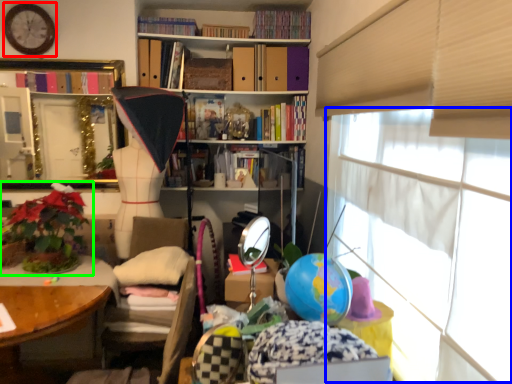
Question: Based on their relative distances, which object is nearer to clock (highlighted by a red box)? Choose from window screen (highlighted by a blue box) and houseplant (highlighted by a green box).

Choices:
 (A) window screen
 (B) houseplant

Answer: (B)